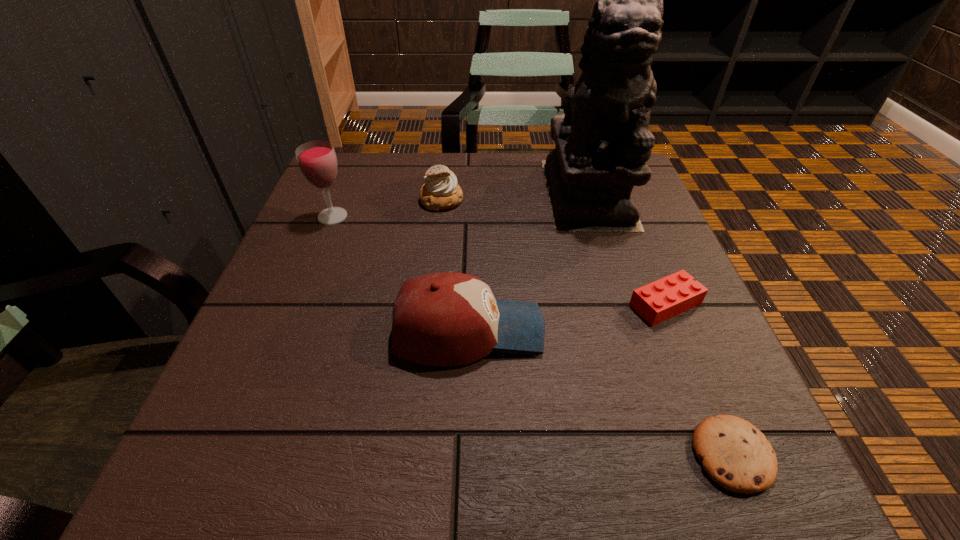
Where is `vacant space located 0.080m on the front-facing side of the baseball cap`? This screenshot has width=960, height=540. vacant space located 0.080m on the front-facing side of the baseball cap is located at coordinates (590, 331).

I want to click on free space located 0.200m on the right of the third shortest object, so click(549, 200).

The width and height of the screenshot is (960, 540). In order to click on free space located 0.310m on the left of the second shortest object in this screenshot , I will do `click(457, 304)`.

The height and width of the screenshot is (540, 960). Find the location of `blank area located 0.070m on the left of the nearest object`. blank area located 0.070m on the left of the nearest object is located at coordinates (641, 455).

The image size is (960, 540). What are the coordinates of `sculpture at the far edge` in the screenshot? It's located at (603, 142).

Where is `pastry that is at the far edge`? pastry that is at the far edge is located at coordinates point(440,192).

At what (x,y) coordinates should I click in order to perform the action: click on object that is at the near edge. Please return your answer as a coordinate pair (x, y). Looking at the image, I should click on 736,455.

I want to click on object present at the left edge, so click(x=317, y=161).

Locate an element on the screen. The width and height of the screenshot is (960, 540). sculpture present at the right edge is located at coordinates (603, 142).

Where is `Lego that is positioned at the right edge`? This screenshot has width=960, height=540. Lego that is positioned at the right edge is located at coordinates (656, 302).